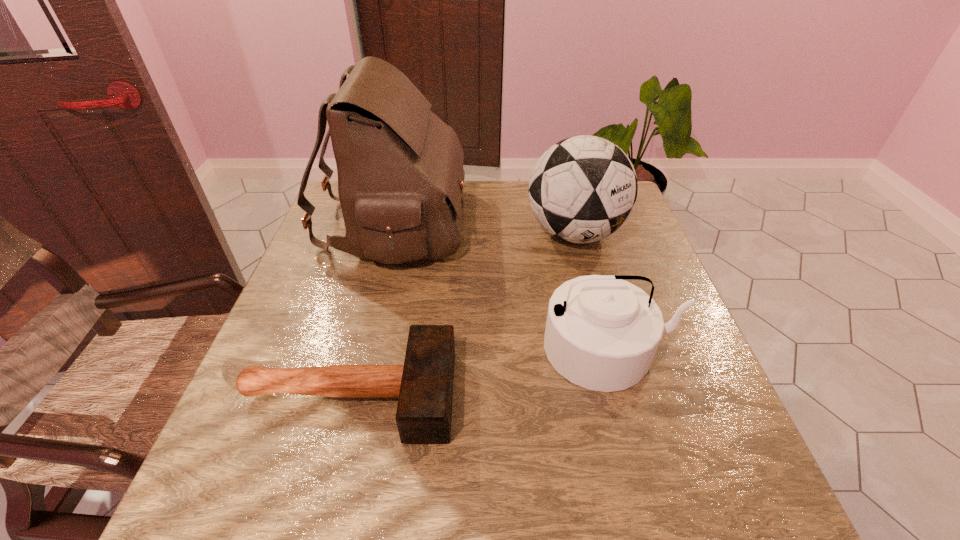
The width and height of the screenshot is (960, 540). I want to click on unoccupied position between the kettle and the tallest object, so click(x=501, y=286).

Locate an element on the screen. the closest object to the third shortest object is located at coordinates (602, 333).

Select which object is the second closest to the satchel. Please provide its 2D coordinates. Your answer should be formatted as a tuple, i.e. [(x, y)], where the tuple contains the x and y coordinates of a point satisfying the conditions above.

[(602, 333)]

Where is `free location that satisfies the following two spatial constraints: 1. on the surface of the third shortest object where the brand logo is visible; 2. on the hammer head face of the mallet`? free location that satisfies the following two spatial constraints: 1. on the surface of the third shortest object where the brand logo is visible; 2. on the hammer head face of the mallet is located at coordinates (617, 394).

Image resolution: width=960 pixels, height=540 pixels. I want to click on vacant region that satisfies the following two spatial constraints: 1. on the surface of the third shortest object where the brand logo is visible; 2. on the hammer head face of the shortest object, so click(x=617, y=394).

The width and height of the screenshot is (960, 540). In order to click on blank area in the image that satisfies the following two spatial constraints: 1. on the spout of the second shortest object; 2. on the hammer head face of the shortest object in this screenshot , I will do `click(622, 394)`.